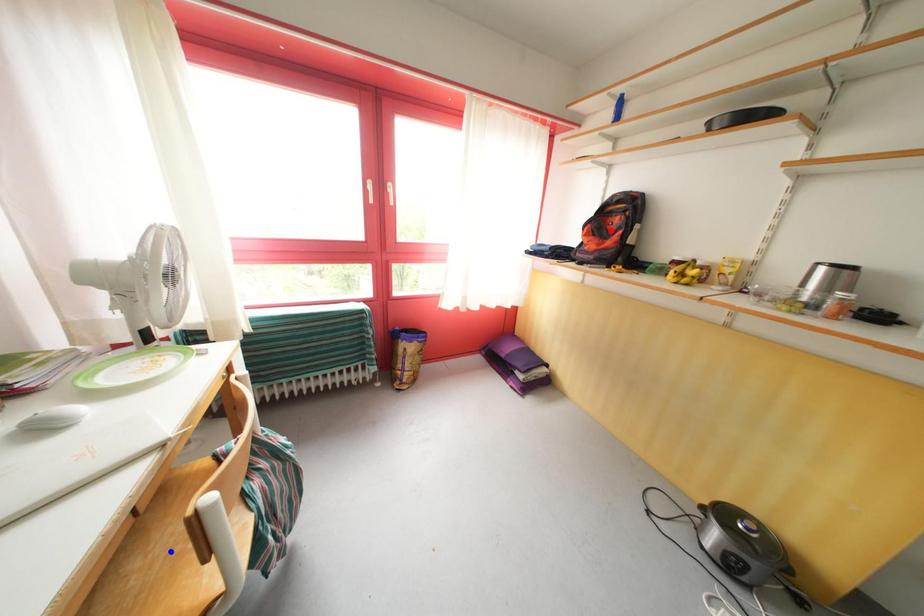
Question: Which of the two points in the image is closer to the camera?

Choices:
 (A) Blue point is closer.
 (B) Red point is closer.

Answer: (A)